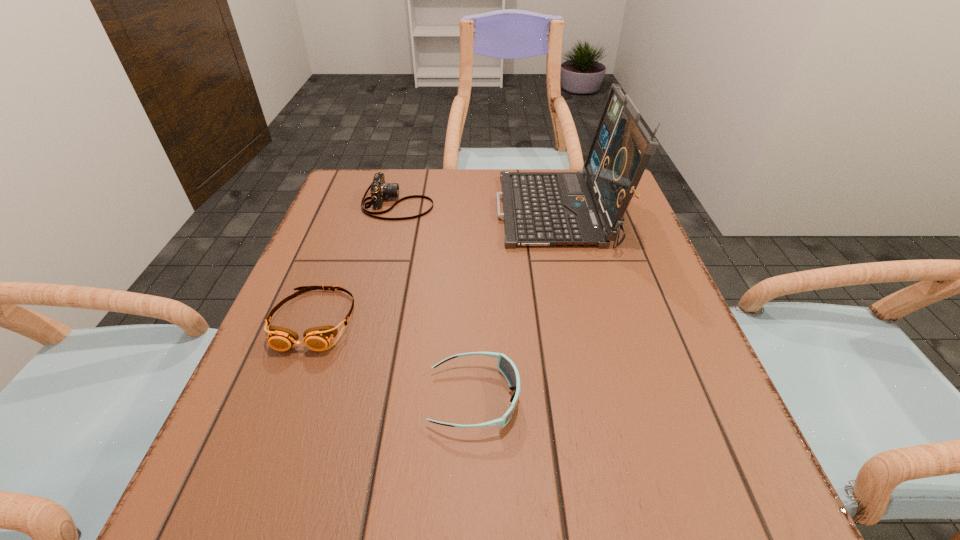
Where is `the tallest object`? The height and width of the screenshot is (540, 960). the tallest object is located at coordinates (539, 208).

The image size is (960, 540). Identify the location of camera. (379, 189).

Locate an element on the screen. The height and width of the screenshot is (540, 960). the farther goggles is located at coordinates (318, 338).

Where is `the second nearest object`? This screenshot has height=540, width=960. the second nearest object is located at coordinates [318, 338].

Where is `the nearer goggles`? The width and height of the screenshot is (960, 540). the nearer goggles is located at coordinates (506, 366).

At what (x,y) coordinates should I click in order to perform the action: click on the right goggles. Please return your answer as a coordinate pair (x, y). This screenshot has height=540, width=960. Looking at the image, I should click on (506, 366).

Where is `free region located 0.210m on the front-facing side of the laptop computer`? The image size is (960, 540). free region located 0.210m on the front-facing side of the laptop computer is located at coordinates (415, 212).

Identify the location of vacant space located 0.360m on the front-facing side of the laptop computer. This screenshot has width=960, height=540. (356, 212).

Where is `vacant space located on the front-facing side of the laptop computer`? The width and height of the screenshot is (960, 540). vacant space located on the front-facing side of the laptop computer is located at coordinates (348, 212).

You are a GUI agent. You are given a task and a screenshot of the screen. Output one action in this format:
    pyautogui.click(x=<x>, y=<y>)
    Task: Click on the blank space located 0.210m on the front-facing side of the camera
    
    Given the screenshot: What is the action you would take?
    pyautogui.click(x=514, y=204)